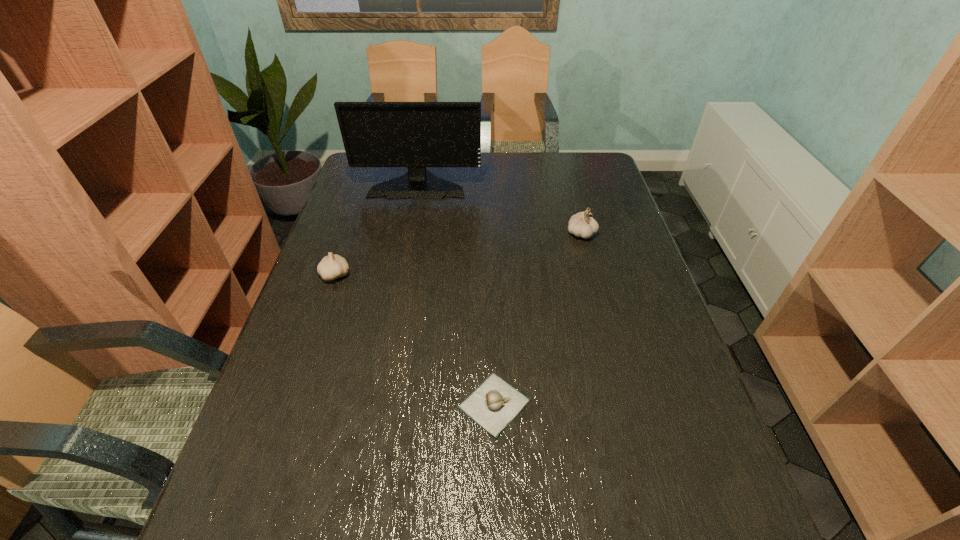
Where is `vacant region that satisfies the following two spatial constraints: 1. on the screen side of the tallest object; 2. on the right side of the third nearest object`? The image size is (960, 540). vacant region that satisfies the following two spatial constraints: 1. on the screen side of the tallest object; 2. on the right side of the third nearest object is located at coordinates (409, 233).